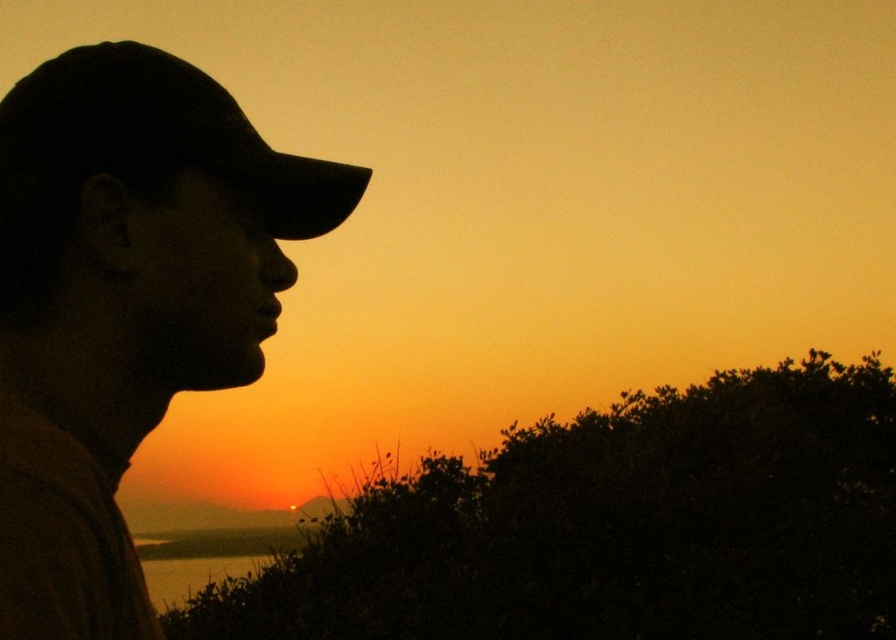
Question: Which point is closer to the camera taking this photo?

Choices:
 (A) (204, 163)
 (B) (162, 401)

Answer: (A)

Question: Is silhouette cap at left to the left of black matte baseball hat at left from the viewer's perspective?

Choices:
 (A) no
 (B) yes

Answer: (B)

Question: Which of the following is the closest to the observer?

Choices:
 (A) silhouette cap at left
 (B) black matte baseball hat at left

Answer: (A)

Question: Does silhouette cap at left come behind black matte baseball hat at left?

Choices:
 (A) yes
 (B) no

Answer: (B)

Question: Which object is farther from the camera taking this photo?

Choices:
 (A) black matte baseball hat at left
 (B) silhouette cap at left

Answer: (A)

Question: Can you confirm if silhouette cap at left is wider than black matte baseball hat at left?

Choices:
 (A) yes
 (B) no

Answer: (B)